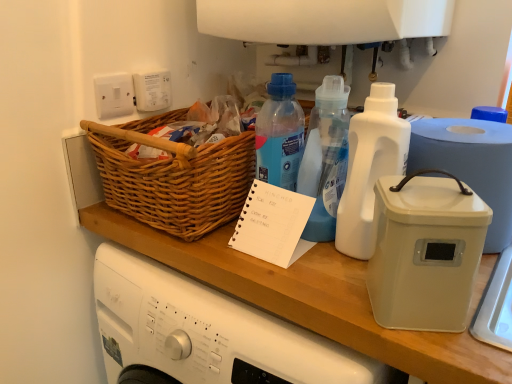
Question: In the image, is white plastic container at right positioned in front of or behind white paper notepad at center?

Choices:
 (A) behind
 (B) front

Answer: (B)

Question: Is white plastic container at right taller or shorter than white paper notepad at center?

Choices:
 (A) tall
 (B) short

Answer: (A)

Question: Which object is the closest to the white plastic bottle at center, the 1th bottle when ordered from left to right?

Choices:
 (A) woven wood basket at upper left
 (B) white plastic container at right
 (C) white paper notepad at center
 (D) white plastic bottle at center-right, the second bottle positioned from the left
 (E) white plastic container at right

Answer: (D)

Question: Considering the real-world distances, which object is farthest from the white paper notepad at center?

Choices:
 (A) white plastic bottle at center, the second bottle viewed from the right
 (B) white plastic container at right
 (C) white plastic container at right
 (D) woven wood basket at upper left
 (E) white plastic bottle at center-right, the second bottle positioned from the left

Answer: (B)